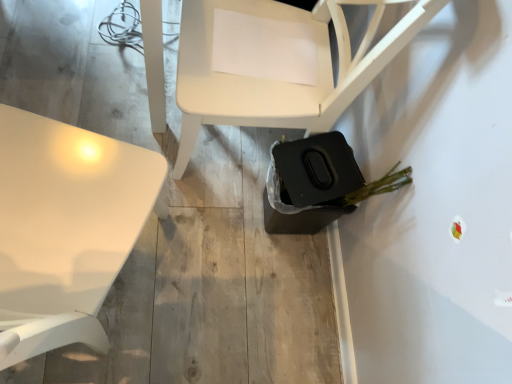
Identify the location of free space to the left of matte white chair at center. The height and width of the screenshot is (384, 512). (112, 87).